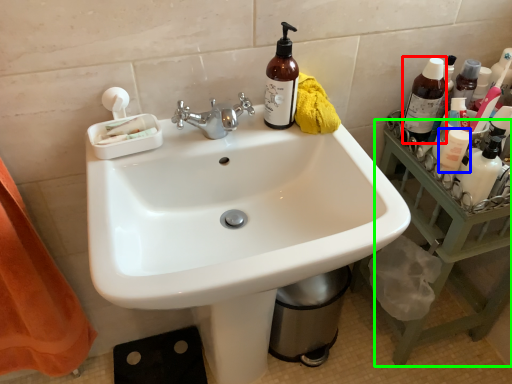
Question: Which is farther away from bottle (highlighted by a red box)? mouthwash (highlighted by a blue box) or counter top (highlighted by a green box)?

Choices:
 (A) mouthwash
 (B) counter top

Answer: (B)